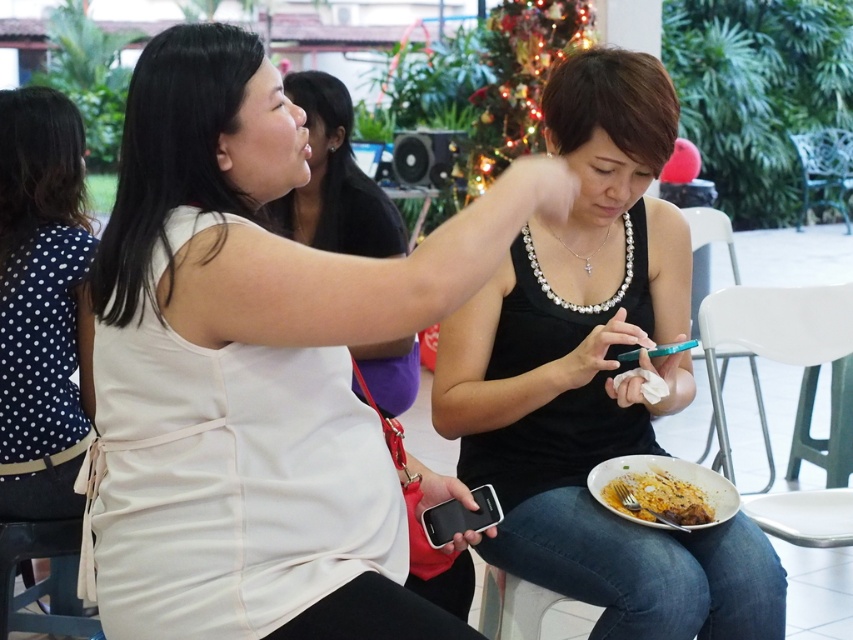
At what (x,y) coordinates should I click in order to perform the action: click on white matte tank top at upper left. Please return your answer as a coordinate pair (x, y). Looking at the image, I should click on (254, 369).

Is white matte tank top at upper left shorter than dark blue polka dot blouse at left?

Yes.

What do you see at coordinates (254, 369) in the screenshot? The width and height of the screenshot is (853, 640). I see `white matte tank top at upper left` at bounding box center [254, 369].

Image resolution: width=853 pixels, height=640 pixels. I want to click on white matte tank top at upper left, so click(254, 369).

Is white plastic chair at right thinner than pearl necklace at center?

No, white plastic chair at right is not thinner than pearl necklace at center.

Can you confirm if white plastic chair at right is smaller than pearl necklace at center?

No.

Which is in front, point (695, 209) or point (611, 301)?

Positioned in front is point (611, 301).

The height and width of the screenshot is (640, 853). Find the location of `white plastic chair at right`. white plastic chair at right is located at coordinates (709, 236).

Is white matte dress at upper left bigger than golden crispy chicken at lower right?

Yes, white matte dress at upper left is bigger than golden crispy chicken at lower right.

Is white matte dress at upper left smaller than golden crispy chicken at lower right?

No, white matte dress at upper left is not smaller than golden crispy chicken at lower right.

This screenshot has height=640, width=853. In order to click on white matte dress at upper left in this screenshot , I will do `click(334, 180)`.